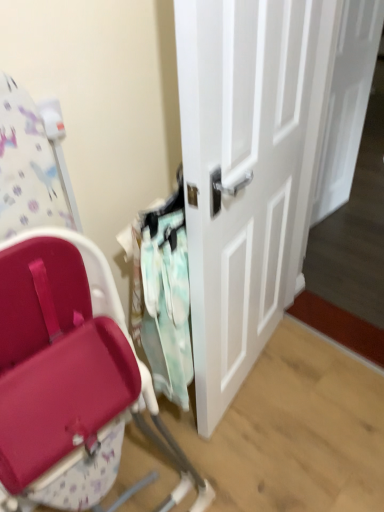
Question: In which direction should I rotate to look at white glossy door at center, the second door positioned from the front?

Choices:
 (A) left
 (B) right

Answer: (B)

Question: Is the depth of white glossy door at center, which ranks as the second door in right-to-left order, greater than that of white glossy door at center, the second door positioned from the front?

Choices:
 (A) yes
 (B) no

Answer: (B)

Question: From the image's perspective, would you say white glossy door at center, which ranks as the second door in right-to-left order, is shown under white glossy door at center, which is the 1th door in right-to-left order?

Choices:
 (A) yes
 (B) no

Answer: (A)

Question: Is the position of white glossy door at center, which is the first door from left to right, less distant than that of white glossy door at center, which is the 1th door in right-to-left order?

Choices:
 (A) yes
 (B) no

Answer: (A)

Question: Does white glossy door at center, arranged as the first door when viewed from the front, have a lesser width compared to white glossy door at center, arranged as the 1th door when viewed from the back?

Choices:
 (A) no
 (B) yes

Answer: (A)

Question: Is white glossy door at center, which is the first door from left to right, located outside white glossy door at center, arranged as the 2th door when viewed from the left?

Choices:
 (A) yes
 (B) no

Answer: (A)

Question: From the image's perspective, is white glossy door at center, arranged as the first door when viewed from the front, located above white glossy door at center, arranged as the 2th door when viewed from the left?

Choices:
 (A) yes
 (B) no

Answer: (B)

Question: Is white glossy door at center, the second door positioned from the back, a part of white glossy door at center, arranged as the 1th door when viewed from the back?

Choices:
 (A) no
 (B) yes

Answer: (A)

Question: Is the depth of white glossy door at center, arranged as the 2th door when viewed from the left, less than that of white glossy door at center, the second door positioned from the back?

Choices:
 (A) yes
 (B) no

Answer: (B)

Question: Is white glossy door at center, arranged as the 1th door when viewed from the back, far from white glossy door at center, which is the first door from left to right?

Choices:
 (A) yes
 (B) no

Answer: (B)

Question: Can you confirm if white glossy door at center, the second door positioned from the front, is shorter than white glossy door at center, arranged as the first door when viewed from the front?

Choices:
 (A) no
 (B) yes

Answer: (B)

Question: From a real-world perspective, is white glossy door at center, arranged as the 1th door when viewed from the back, on top of white glossy door at center, the second door positioned from the back?

Choices:
 (A) yes
 (B) no

Answer: (B)

Question: Does white glossy door at center, arranged as the 1th door when viewed from the back, turn towards white glossy door at center, which is the first door from left to right?

Choices:
 (A) no
 (B) yes

Answer: (A)

Question: From the image's perspective, is mint fabric laundry at center below white glossy door at center, arranged as the first door when viewed from the front?

Choices:
 (A) yes
 (B) no

Answer: (A)